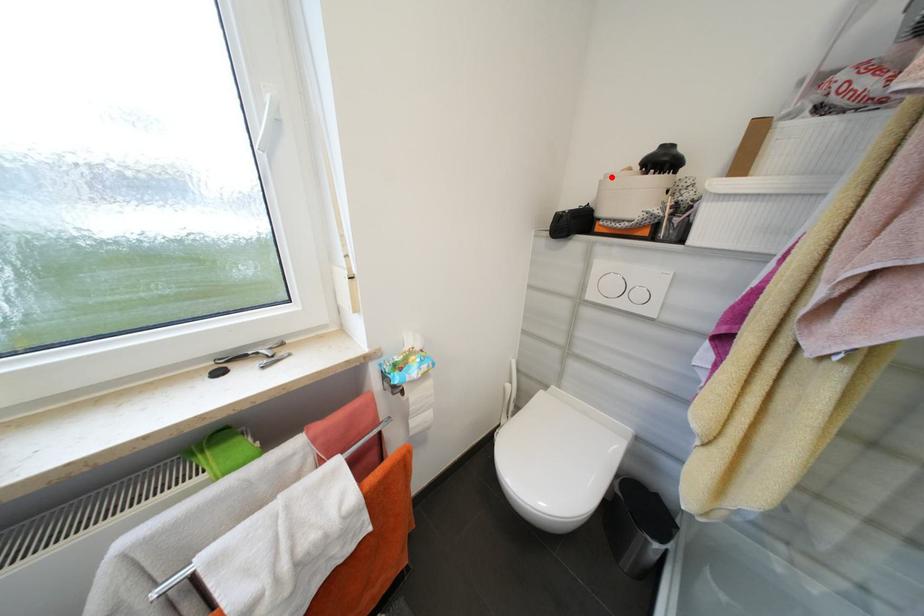
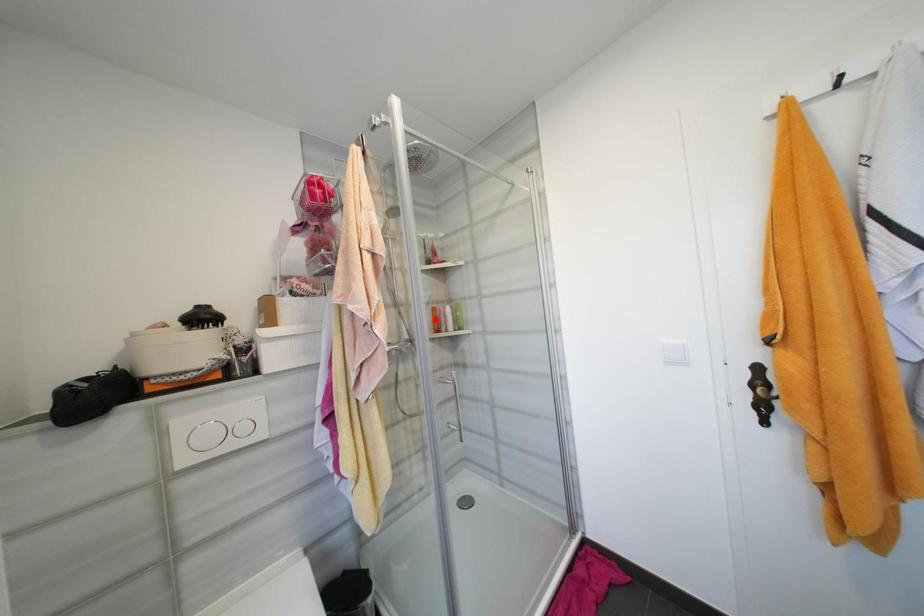
I am providing you with two images of the same scene from different viewpoints. A red point is marked on the first image and another point is marked on the second image. Is the red point in image1 aligned with the point shown in image2?

No